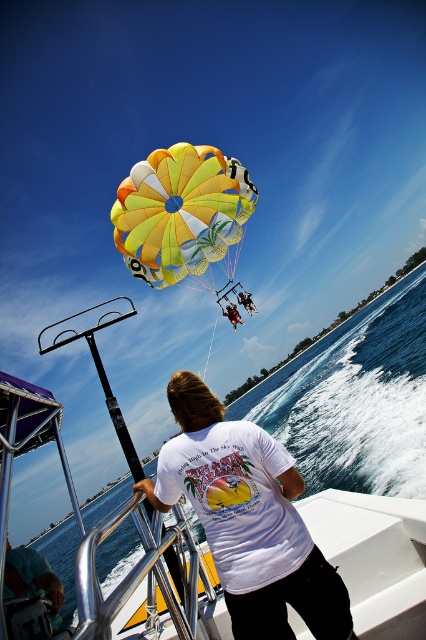
You are a drone operator trying to capture the best aerial shot of the parasailing scene. The yellow fabric parachute at upper center is your main subject. Based on its position at point 0.331, 0.425, where should you position the drone to ensure it is centered in the frame?

The yellow fabric parachute at upper center is located at point (181, 211), so positioning the drone directly above this coordinate will center it in the frame.